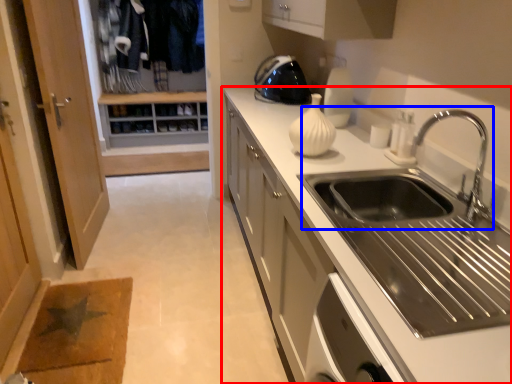
Question: Which point is closer to the camera, countertop (highlighted by a red box) or sink (highlighted by a blue box)?

Choices:
 (A) countertop
 (B) sink

Answer: (A)